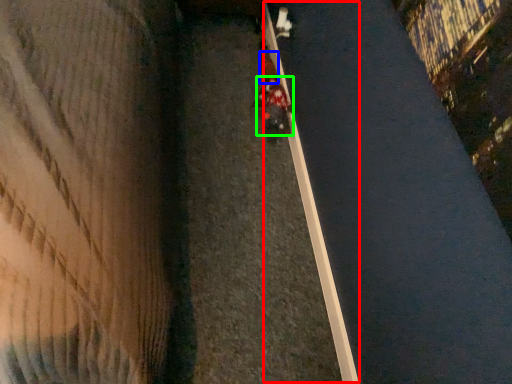
Question: Based on their relative distances, which object is farther from curb (highlighted by a red box)? Choose from pedestrian (highlighted by a blue box) and person (highlighted by a green box).

Choices:
 (A) pedestrian
 (B) person

Answer: (A)